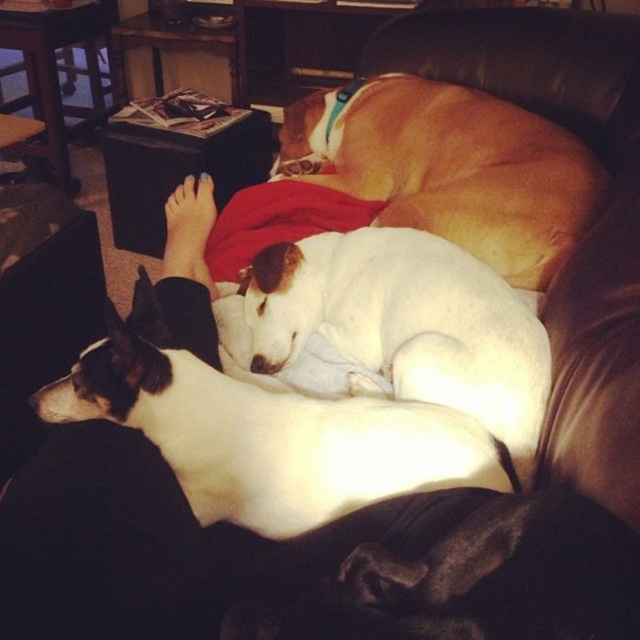
Question: Is white fur dog at center to the left of white fur at center from the viewer's perspective?

Choices:
 (A) yes
 (B) no

Answer: (A)

Question: Among these objects, which one is nearest to the camera?

Choices:
 (A) white fur dog at center
 (B) white smooth dog at center
 (C) white fur at center

Answer: (B)

Question: Which of the following is the farthest from the observer?

Choices:
 (A) (269, 490)
 (B) (408, 173)

Answer: (B)

Question: Is the position of white smooth dog at center more distant than that of white fur dog at center?

Choices:
 (A) no
 (B) yes

Answer: (A)

Question: Can you confirm if white smooth dog at center is thinner than white fur dog at center?

Choices:
 (A) yes
 (B) no

Answer: (B)

Question: Considering the real-world distances, which object is closest to the white smooth dog at center?

Choices:
 (A) white fur at center
 (B) white fur dog at center

Answer: (B)